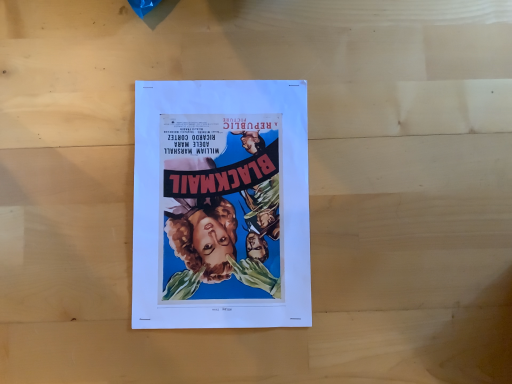
Identify the location of vacant space situated above matte paper poster at center (from a real-world perspective). The width and height of the screenshot is (512, 384). (229, 195).